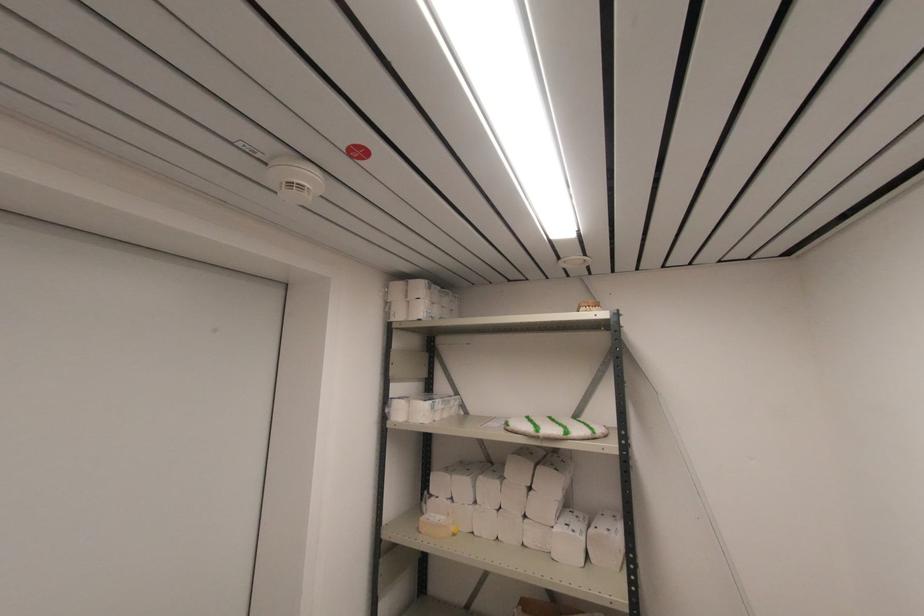
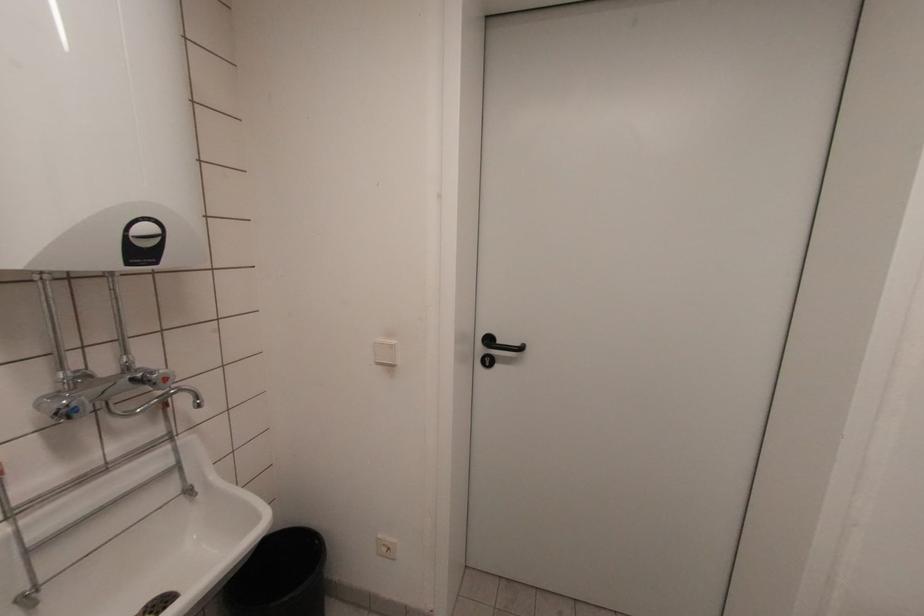
Question: The first image is from the beginning of the video and the second image is from the end. How did the camera likely rotate when shooting the video?

Choices:
 (A) Left
 (B) Right
 (C) Up
 (D) Down

Answer: (A)